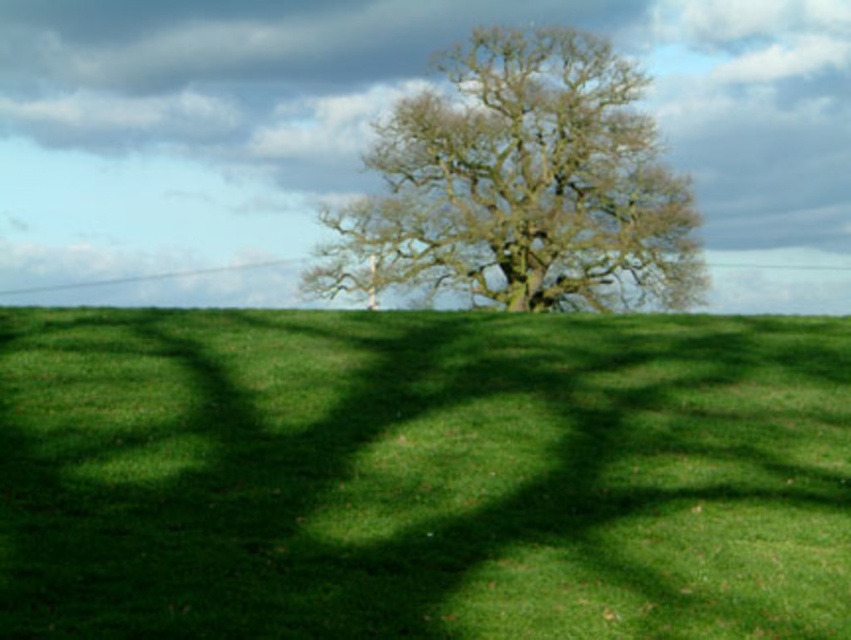
Between green grass at center and green leafy tree at center, which one is positioned higher?

green leafy tree at center

Is green grass at center closer to the viewer compared to green leafy tree at center?

Yes, green grass at center is in front of green leafy tree at center.

In order to click on green grass at center in this screenshot , I will do `click(421, 476)`.